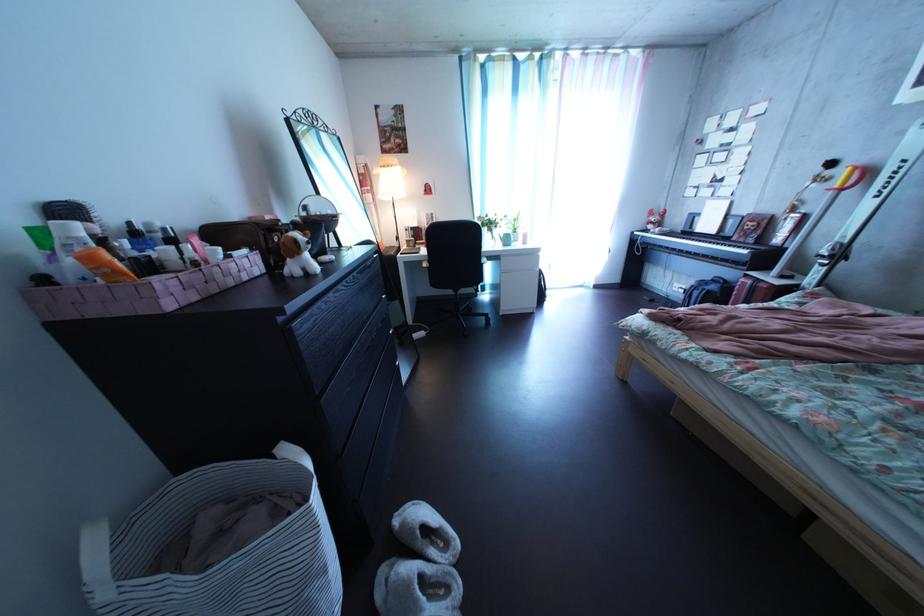
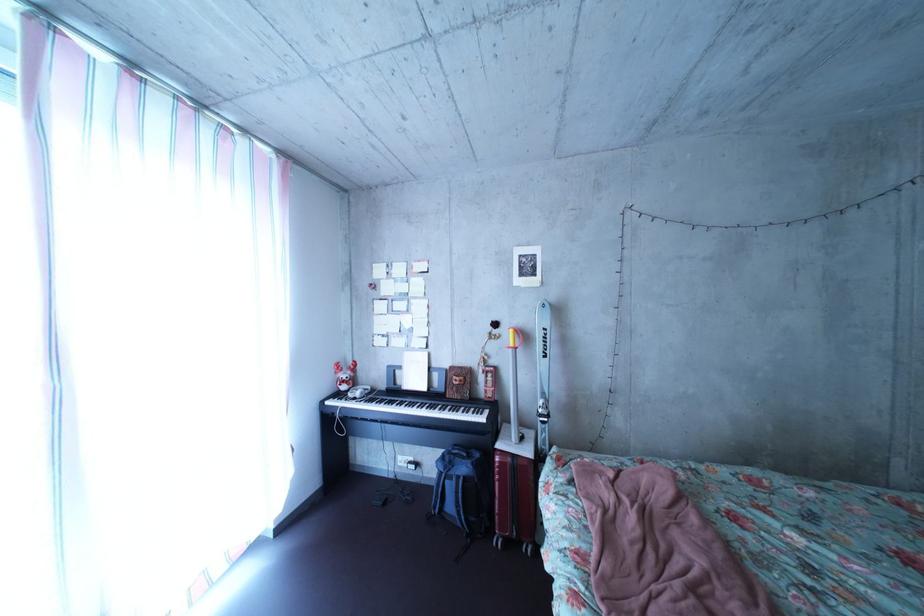
The point at (842, 180) is marked in the first image. Where is the corresponding point in the second image?

(509, 339)